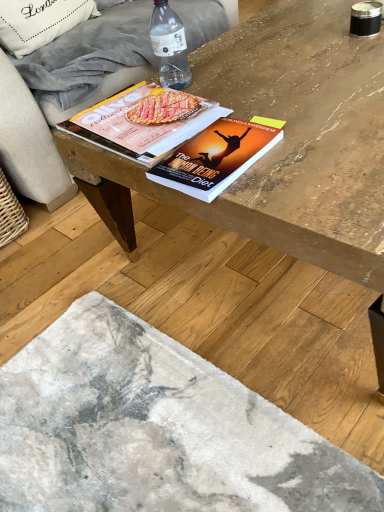
Question: In terms of size, does wooden table at center appear bigger or smaller than wooden coffee table at center?

Choices:
 (A) small
 (B) big

Answer: (A)

Question: From the image's perspective, is wooden table at center above or below wooden coffee table at center?

Choices:
 (A) below
 (B) above

Answer: (A)

Question: Which of these objects is positioned farthest from the hardcover book at center, acting as the second book starting from the back?

Choices:
 (A) matte paper magazine at center, marked as the first book in a back-to-front arrangement
 (B) beige fabric couch at upper left
 (C) white fabric pillow at upper left
 (D) wooden coffee table at center
 (E) wooden table at center

Answer: (C)

Question: Which of these objects is positioned closest to the hardcover book at center, acting as the second book starting from the back?

Choices:
 (A) matte paper magazine at center, which is the 2th book from front to back
 (B) transparent plastic bottle at upper center
 (C) wooden table at center
 (D) wooden coffee table at center
 (E) beige fabric couch at upper left

Answer: (A)